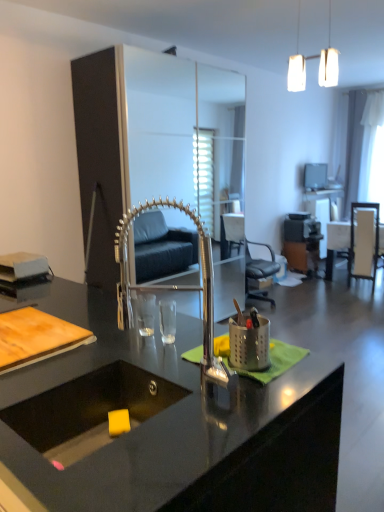
Question: In terms of height, does metallic brown computer desk at center look taller or shorter compared to black leather chair at center, acting as the 1th chair starting from the left?

Choices:
 (A) short
 (B) tall

Answer: (A)

Question: From the image's perspective, is metallic brown computer desk at center located above or below black leather chair at center, acting as the 1th chair starting from the left?

Choices:
 (A) above
 (B) below

Answer: (B)

Question: Estimate the real-world distances between objects in this image. Which object is closer to the black granite sink at center?

Choices:
 (A) matte silver television at upper right
 (B) white matte pendant lights at upper center
 (C) white glossy table at right, acting as the first table starting from the back
 (D) black leather chair at center, acting as the 1th chair starting from the left
 (E) metallic brown computer desk at center

Answer: (B)

Question: Estimate the real-world distances between objects in this image. Which object is farther from the polished chrome faucet at center?

Choices:
 (A) white glossy table at right, the 2th table in the front-to-back sequence
 (B) wooden chair at right, marked as the 1th chair in a right-to-left arrangement
 (C) matte silver television at upper right
 (D) black granite sink at center
 (E) metallic brown computer desk at center

Answer: (C)